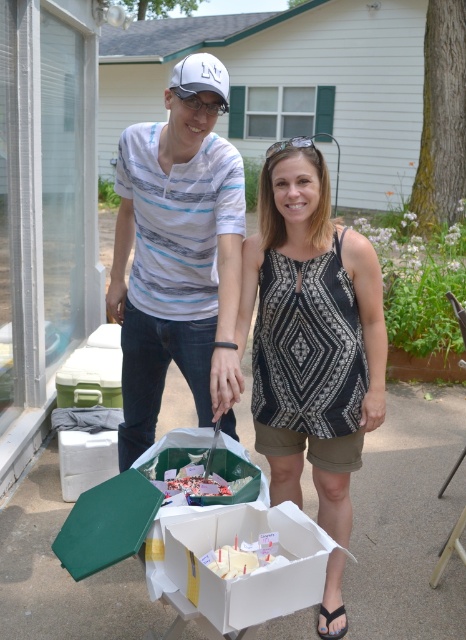
You are organizing a picnic and need to pack items from the scene. You have a limited space in your bag. Which item, the white printed tank top at center or the white frosted cake at center, should you prioritize packing first based on their height?

The white printed tank top at center is taller than the white frosted cake at center, so you should prioritize packing the white frosted cake at center first as it is shorter and may fit better in the limited space.

Based on the scene description, where is the white printed tank top at center located in terms of its 2D coordinates?

The white printed tank top at center is located at the 2D coordinates of point (306, 332).